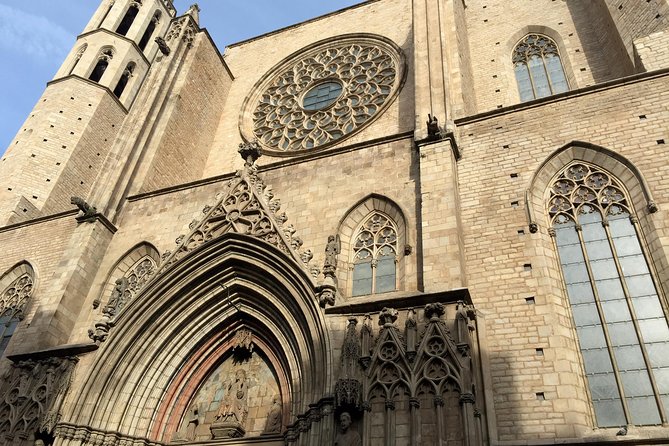
Find the location of a particular element. This screenshot has height=446, width=669. center of round window is located at coordinates (320, 92).